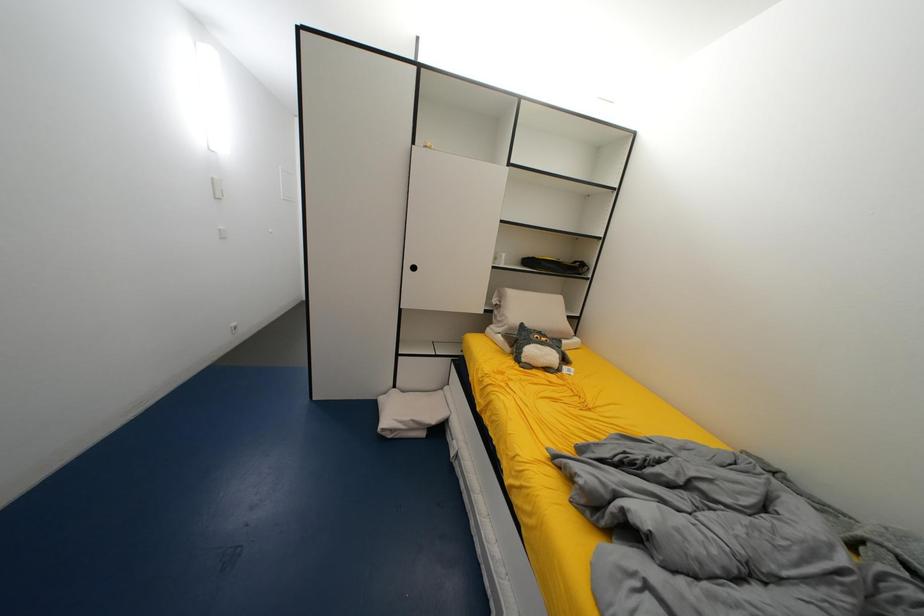
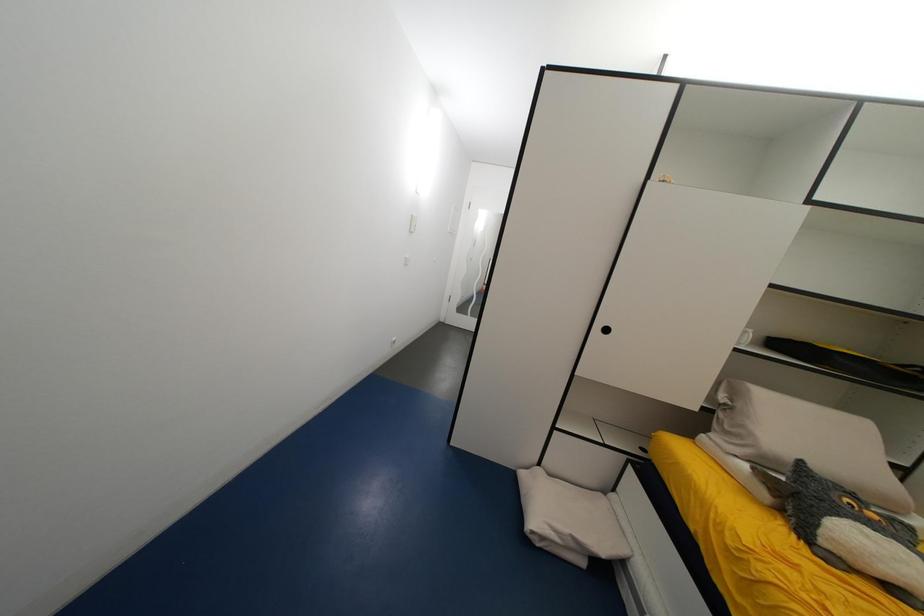
Question: The camera is either moving clockwise (left) or counter-clockwise (right) around the object. The first image is from the beginning of the video and the second image is from the end. Is the camera moving left or right when shooting the video?

Choices:
 (A) Left
 (B) Right

Answer: (B)